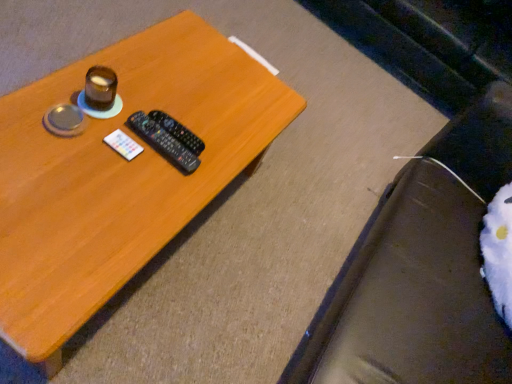
Identify the location of free point behind black plastic remote at center, placed as the second remote control when sorted from back to front. The width and height of the screenshot is (512, 384). (193, 108).